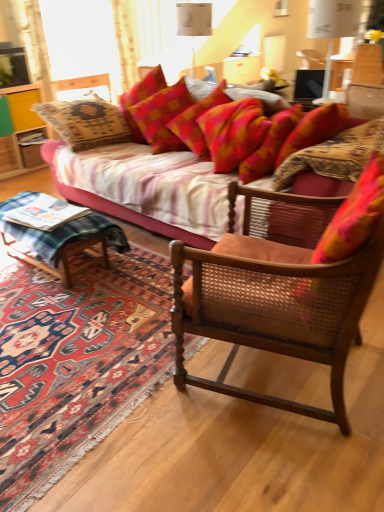
Question: Does textured fabric couch at center appear on the right side of carpeted rug at lower left?

Choices:
 (A) yes
 (B) no

Answer: (A)

Question: Is textured fabric couch at center oriented towards carpeted rug at lower left?

Choices:
 (A) yes
 (B) no

Answer: (A)

Question: From a real-world perspective, is textured fabric couch at center on top of carpeted rug at lower left?

Choices:
 (A) no
 (B) yes

Answer: (B)

Question: From a real-world perspective, is textured fabric couch at center under carpeted rug at lower left?

Choices:
 (A) yes
 (B) no

Answer: (B)

Question: Does textured fabric couch at center have a larger size compared to carpeted rug at lower left?

Choices:
 (A) no
 (B) yes

Answer: (B)

Question: Does point (322, 199) appear closer or farther from the camera than point (26, 129)?

Choices:
 (A) closer
 (B) farther

Answer: (A)

Question: In terms of width, does wooden cane chair at center look wider or thinner when compared to yellow wood cabinet at left?

Choices:
 (A) wide
 (B) thin

Answer: (A)

Question: Is wooden cane chair at center situated inside yellow wood cabinet at left or outside?

Choices:
 (A) inside
 (B) outside

Answer: (B)

Question: From a real-world perspective, is wooden cane chair at center above or below yellow wood cabinet at left?

Choices:
 (A) below
 (B) above

Answer: (B)

Question: From a real-world perspective, is textured fabric couch at center physically located above or below green plaid wood at lower left?

Choices:
 (A) above
 (B) below

Answer: (A)

Question: Would you say textured fabric couch at center is inside or outside green plaid wood at lower left?

Choices:
 (A) inside
 (B) outside

Answer: (B)

Question: Based on their sizes in the image, would you say textured fabric couch at center is bigger or smaller than green plaid wood at lower left?

Choices:
 (A) small
 (B) big

Answer: (B)

Question: From the image's perspective, is textured fabric couch at center located above or below green plaid wood at lower left?

Choices:
 (A) above
 (B) below

Answer: (A)

Question: Is textured fabric couch at center wider or thinner than carpeted rug at lower left?

Choices:
 (A) wide
 (B) thin

Answer: (B)

Question: From the image's perspective, is textured fabric couch at center above or below carpeted rug at lower left?

Choices:
 (A) below
 (B) above

Answer: (B)